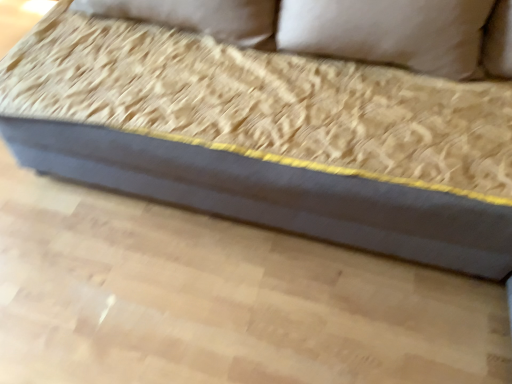
Question: Is beige fabric pillow at upper center wider than dark gray fabric couch at center?

Choices:
 (A) yes
 (B) no

Answer: (B)

Question: From the image's perspective, is beige fabric pillow at upper center located above dark gray fabric couch at center?

Choices:
 (A) no
 (B) yes

Answer: (B)

Question: Can you confirm if beige fabric pillow at upper center is positioned to the left of dark gray fabric couch at center?

Choices:
 (A) yes
 (B) no

Answer: (B)

Question: Is there a large distance between beige fabric pillow at upper center and dark gray fabric couch at center?

Choices:
 (A) yes
 (B) no

Answer: (B)

Question: Is beige fabric pillow at upper center turned away from dark gray fabric couch at center?

Choices:
 (A) yes
 (B) no

Answer: (A)

Question: Does beige fabric pillow at upper center have a lesser height compared to dark gray fabric couch at center?

Choices:
 (A) yes
 (B) no

Answer: (A)

Question: From a real-world perspective, is dark gray fabric couch at center positioned under beige fabric pillow at upper center based on gravity?

Choices:
 (A) no
 (B) yes

Answer: (B)

Question: Does dark gray fabric couch at center have a larger size compared to beige fabric pillow at upper center?

Choices:
 (A) yes
 (B) no

Answer: (A)

Question: Is dark gray fabric couch at center behind beige fabric pillow at upper center?

Choices:
 (A) yes
 (B) no

Answer: (B)

Question: From a real-world perspective, is dark gray fabric couch at center over beige fabric pillow at upper center?

Choices:
 (A) yes
 (B) no

Answer: (B)

Question: Is dark gray fabric couch at center smaller than beige fabric pillow at upper center?

Choices:
 (A) no
 (B) yes

Answer: (A)

Question: Does dark gray fabric couch at center have a lesser width compared to beige fabric pillow at upper center?

Choices:
 (A) no
 (B) yes

Answer: (A)

Question: Based on their sizes in the image, would you say beige fabric pillow at upper center is bigger or smaller than dark gray fabric couch at center?

Choices:
 (A) big
 (B) small

Answer: (B)